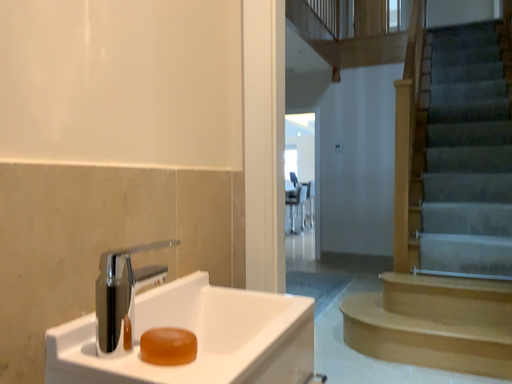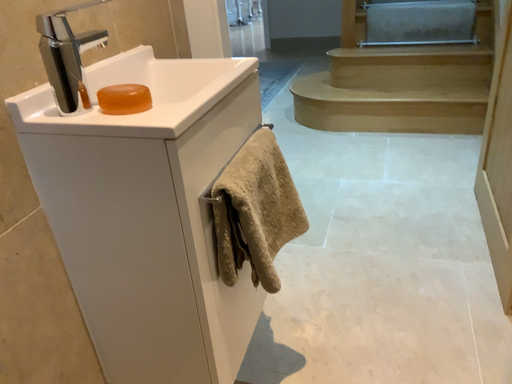
Question: Which way did the camera rotate in the video?

Choices:
 (A) rotated left
 (B) rotated right

Answer: (B)